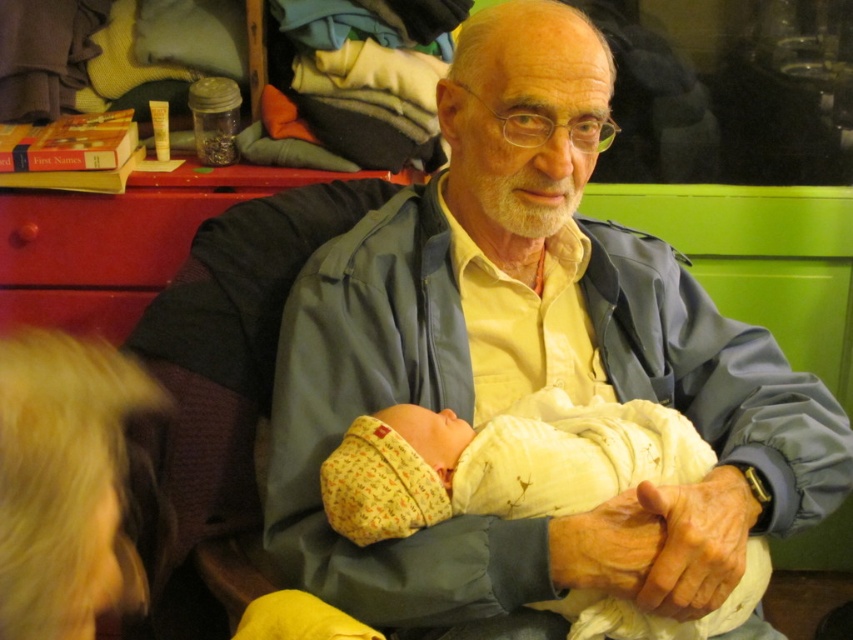
Who is higher up, yellow cotton swaddle at center or red wood drawer at left?

red wood drawer at left is higher up.

Between yellow cotton swaddle at center and red wood drawer at left, which one appears on the left side from the viewer's perspective?

red wood drawer at left

The image size is (853, 640). I want to click on yellow cotton swaddle at center, so click(502, 461).

Measure the distance between point (498, 77) and camera.

1.03 meters

Is matte blue jacket at center taller than red wood drawer at left?

Yes.

Identify the location of matte blue jacket at center. The image size is (853, 640). (532, 362).

Who is lower down, matte blue jacket at center or yellow cotton swaddle at center?

yellow cotton swaddle at center is lower down.

Between matte blue jacket at center and yellow cotton swaddle at center, which one appears on the left side from the viewer's perspective?

yellow cotton swaddle at center

Is point (579, 568) positioned after point (611, 448)?

No, it is not.

You are a GUI agent. You are given a task and a screenshot of the screen. Output one action in this format:
    pyautogui.click(x=<x>, y=<y>)
    Task: Click on the matte blue jacket at center
    This screenshot has width=853, height=640.
    Given the screenshot: What is the action you would take?
    pyautogui.click(x=532, y=362)